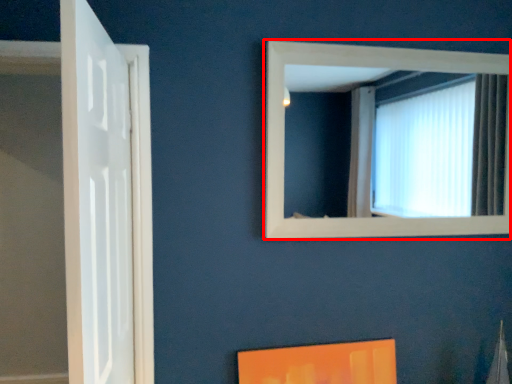
Question: From the image's perspective, what is the correct spatial relationship of window (annotated by the red box) in relation to door?

Choices:
 (A) below
 (B) above

Answer: (B)